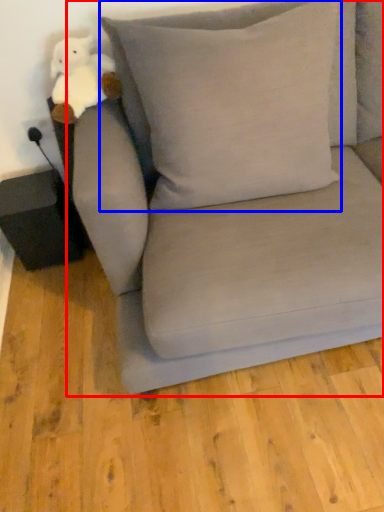
Question: Which object appears farthest to the camera in this image, studio couch (highlighted by a red box) or pillow (highlighted by a blue box)?

Choices:
 (A) studio couch
 (B) pillow

Answer: (B)